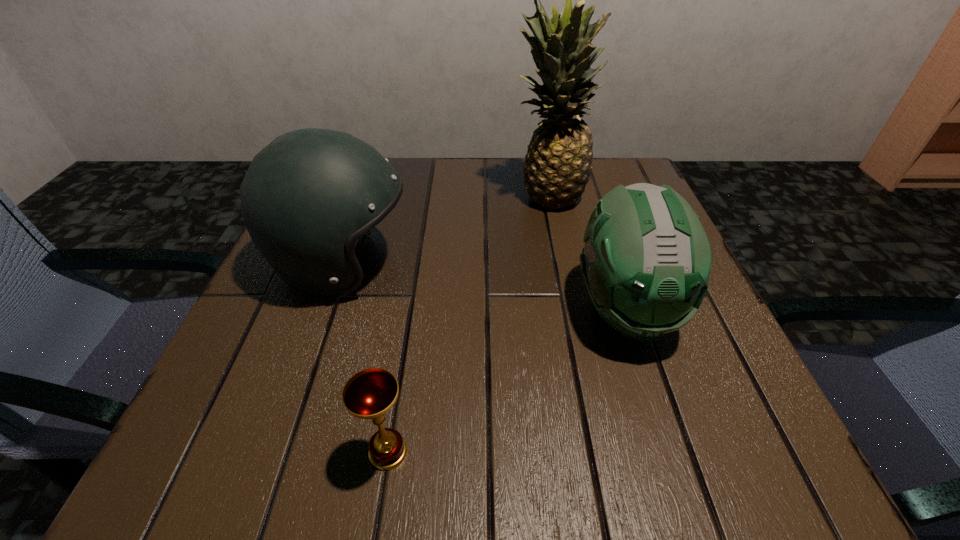
Identify the location of vacant point located 0.120m on the visor of the shorter football helmet. Image resolution: width=960 pixels, height=540 pixels. (668, 441).

The height and width of the screenshot is (540, 960). I want to click on vacant position located 0.390m on the right of the shortest object, so click(x=717, y=452).

This screenshot has width=960, height=540. What are the coordinates of `object located in the far edge section of the desktop` in the screenshot? It's located at (558, 163).

Find the location of a particular element. object situated at the near edge is located at coordinates (370, 393).

You are a GUI agent. You are given a task and a screenshot of the screen. Output one action in this format:
    pyautogui.click(x=<x>, y=<y>)
    Task: Click on the object positioned at the left edge
    
    Given the screenshot: What is the action you would take?
    pyautogui.click(x=306, y=197)

The height and width of the screenshot is (540, 960). Find the location of `pineapple that is at the right edge`. pineapple that is at the right edge is located at coordinates click(x=558, y=163).

The image size is (960, 540). I want to click on football helmet present at the right edge, so click(646, 262).

Find the location of a particular element. object that is positioned at the far right corner is located at coordinates (558, 163).

Image resolution: width=960 pixels, height=540 pixels. In order to click on free space at the far edge of the desktop in this screenshot , I will do `click(477, 196)`.

The image size is (960, 540). I want to click on blank space at the near edge, so click(x=411, y=480).